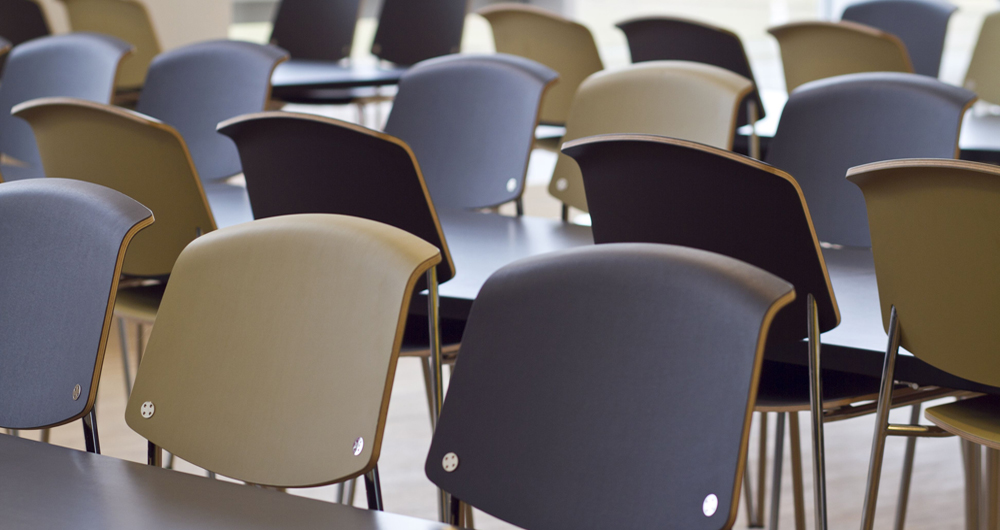
Image resolution: width=1000 pixels, height=530 pixels. Find the location of `off white - tan chair`. off white - tan chair is located at coordinates (316, 300), (121, 156), (652, 104), (553, 39), (869, 35), (997, 52), (958, 225), (107, 15).